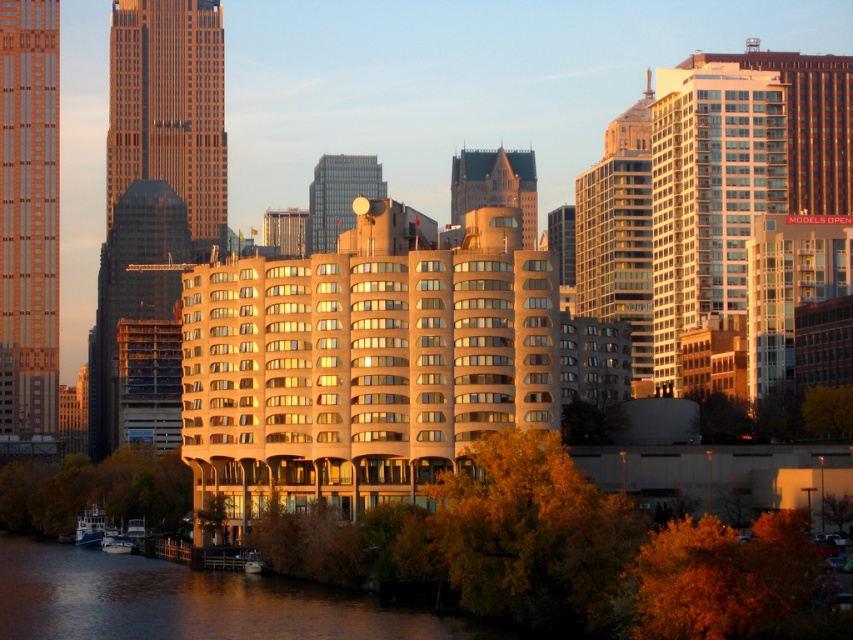
Is the position of dark gray stone tower at upper center less distant than that of metallic satellite dish at center?

That is True.

Who is higher up, dark gray stone tower at upper center or metallic satellite dish at center?

Positioned higher is metallic satellite dish at center.

Image resolution: width=853 pixels, height=640 pixels. What do you see at coordinates (495, 186) in the screenshot? I see `dark gray stone tower at upper center` at bounding box center [495, 186].

Identify the location of dark gray stone tower at upper center. (495, 186).

What are the coordinates of `brown water at lower left` in the screenshot? It's located at (189, 602).

Is glassy reflective building at upper right thinner than brown water at lower left?

Indeed, glassy reflective building at upper right has a lesser width compared to brown water at lower left.

Between glassy reflective building at upper right and brown water at lower left, which one has more height?

glassy reflective building at upper right is taller.

Locate an element on the screen. glassy reflective building at upper right is located at coordinates (709, 196).